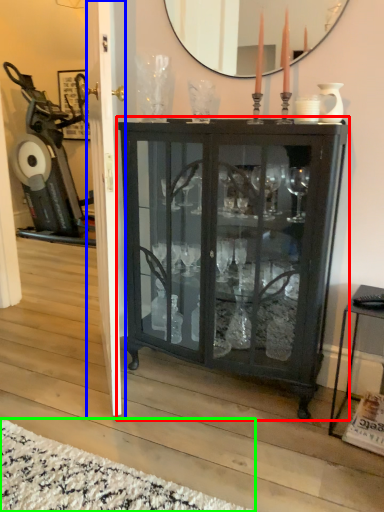
Question: Considering the real-world distances, which object is closest to cupboard (highlighted by a red box)? screen door (highlighted by a blue box) or plain (highlighted by a green box).

Choices:
 (A) screen door
 (B) plain

Answer: (A)